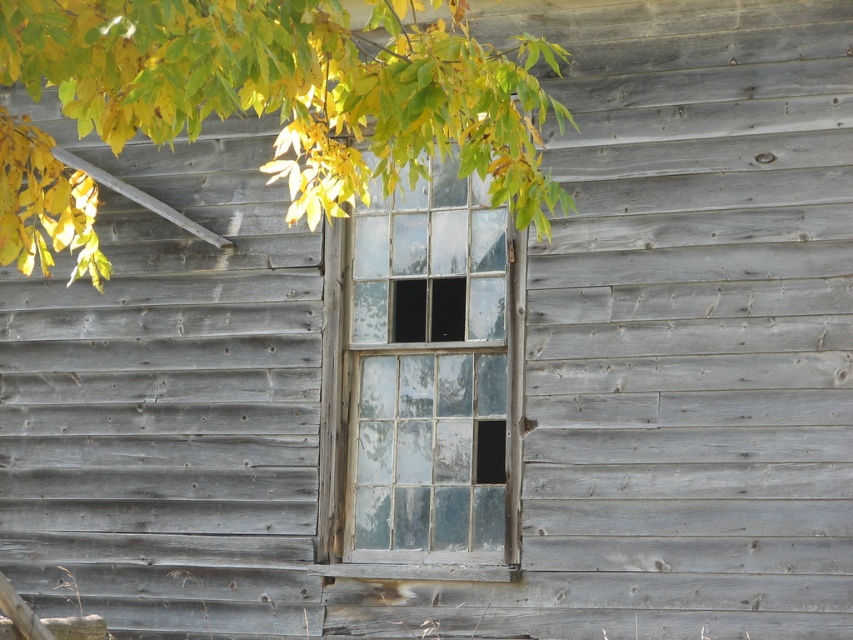
This screenshot has width=853, height=640. What do you see at coordinates (299, 88) in the screenshot?
I see `yellow-green leaves at upper left` at bounding box center [299, 88].

Which is in front, point (316, 17) or point (442, 317)?

Point (316, 17)

I want to click on yellow-green leaves at upper left, so [299, 88].